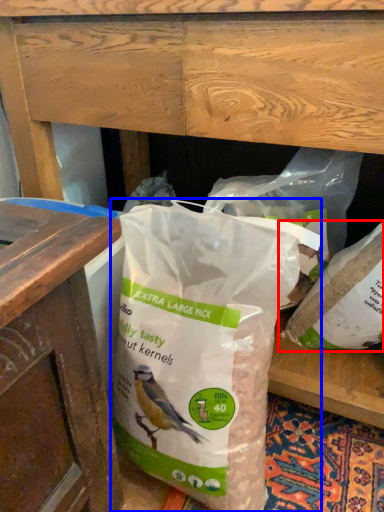
Question: Which point is further to the camera, plastic bag (highlighted by a red box) or plastic bag (highlighted by a blue box)?

Choices:
 (A) plastic bag
 (B) plastic bag

Answer: (A)